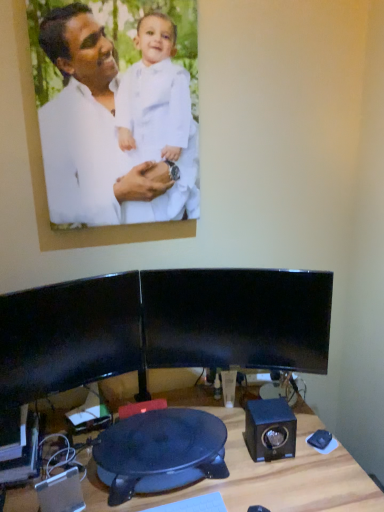
How much space does black plastic speaker at lower left, which is counted as the second speaker, starting from the right, occupy vertically?

black plastic speaker at lower left, which is counted as the second speaker, starting from the right, is 6.90 inches in height.

What is the approximate width of black plastic swivel chair at center?

black plastic swivel chair at center is 12.61 inches in width.

Where is `white matte picture frame at upper left`? This screenshot has height=512, width=384. white matte picture frame at upper left is located at coordinates (86, 151).

Where is `wooden desk at lower center`? This screenshot has height=512, width=384. wooden desk at lower center is located at coordinates (263, 476).

Is black plastic keyboard at lower center at the left side of black plastic swivel chair at center?

Incorrect, black plastic keyboard at lower center is not on the left side of black plastic swivel chair at center.

From a real-world perspective, is black plastic keyboard at lower center physically located above or below black plastic swivel chair at center?

Clearly, from a real-world perspective, black plastic keyboard at lower center is below black plastic swivel chair at center.

Considering the relative sizes of black plastic keyboard at lower center and black plastic swivel chair at center in the image provided, is black plastic keyboard at lower center wider than black plastic swivel chair at center?

No, black plastic keyboard at lower center is not wider than black plastic swivel chair at center.

Could you tell me if black plastic keyboard at lower center is turned towards black plastic swivel chair at center?

No.

Is blue matte speaker at lower right, which appears as the 2th speaker when viewed from the front, shorter than black plastic speaker at lower left, the 2th speaker when ordered from back to front?

Yes.

Looking at this image, is blue matte speaker at lower right, which appears as the 1th speaker when viewed from the right, not inside black plastic speaker at lower left, marked as the 1th speaker in a front-to-back arrangement?

Absolutely, blue matte speaker at lower right, which appears as the 1th speaker when viewed from the right, is external to black plastic speaker at lower left, marked as the 1th speaker in a front-to-back arrangement.

Would you say blue matte speaker at lower right, the first speaker viewed from the back, is a long distance from black plastic speaker at lower left, which is counted as the second speaker, starting from the right?

blue matte speaker at lower right, the first speaker viewed from the back, is actually quite close to black plastic speaker at lower left, which is counted as the second speaker, starting from the right.

From the image's perspective, which is above, blue matte speaker at lower right, which appears as the 1th speaker when viewed from the right, or white matte picture frame at upper left?

white matte picture frame at upper left appears higher in the image.

The width and height of the screenshot is (384, 512). Find the location of `speaker located on the right of white matte picture frame at upper left`. speaker located on the right of white matte picture frame at upper left is located at coordinates (270, 429).

Is the depth of blue matte speaker at lower right, the first speaker viewed from the back, greater than that of white matte picture frame at upper left?

Yes, blue matte speaker at lower right, the first speaker viewed from the back, is behind white matte picture frame at upper left.

Considering the positions of point (219, 495) and point (283, 428), is point (219, 495) closer or farther from the camera than point (283, 428)?

Clearly, point (219, 495) is closer to the camera than point (283, 428).

This screenshot has width=384, height=512. Identify the location of keyboard located underneath the blue matte speaker at lower right, the first speaker viewed from the back (from a real-world perspective). (194, 504).

Would you consider black plastic keyboard at lower center to be distant from blue matte speaker at lower right, which ranks as the second speaker in left-to-right order?

black plastic keyboard at lower center is near blue matte speaker at lower right, which ranks as the second speaker in left-to-right order, not far away.

Consider the image. Who is bigger, black glossy monitor at center, the 1th computer monitor positioned from the right, or black plastic keyboard at lower center?

black glossy monitor at center, the 1th computer monitor positioned from the right, is bigger.

Who is shorter, black glossy monitor at center, the 1th computer monitor positioned from the right, or black plastic keyboard at lower center?

Standing shorter between the two is black plastic keyboard at lower center.

Is black glossy monitor at center, acting as the 2th computer monitor starting from the right, shorter than black plastic speaker at lower left, which ranks as the 1th speaker in left-to-right order?

No, black glossy monitor at center, acting as the 2th computer monitor starting from the right, is not shorter than black plastic speaker at lower left, which ranks as the 1th speaker in left-to-right order.

Which object is positioned more to the left, black glossy monitor at center, the first computer monitor from the left, or black plastic speaker at lower left, the 2th speaker when ordered from back to front?

black glossy monitor at center, the first computer monitor from the left.

From the image's perspective, who appears lower, black glossy monitor at center, the first computer monitor from the left, or black plastic speaker at lower left, the 2th speaker when ordered from back to front?

black plastic speaker at lower left, the 2th speaker when ordered from back to front, appears lower in the image.

Based on the photo, could you tell me if black glossy monitor at center, the first computer monitor from the left, is turned towards black plastic speaker at lower left, which ranks as the 1th speaker in left-to-right order?

No, black glossy monitor at center, the first computer monitor from the left, is not turned towards black plastic speaker at lower left, which ranks as the 1th speaker in left-to-right order.

From a real-world perspective, is black glossy monitor at center, acting as the second computer monitor starting from the left, physically located above or below black plastic swivel chair at center?

black glossy monitor at center, acting as the second computer monitor starting from the left, is situated higher than black plastic swivel chair at center in the real world.

Between point (239, 276) and point (151, 482), which one is positioned behind?

The point (239, 276) is farther from the camera.

Is black plastic swivel chair at center a part of black glossy monitor at center, the 1th computer monitor positioned from the right?

No.

Can you tell me how much black glossy monitor at center, acting as the second computer monitor starting from the left, and black plastic swivel chair at center differ in facing direction?

There is a 18-degree angle between the facing directions of black glossy monitor at center, acting as the second computer monitor starting from the left, and black plastic swivel chair at center.

This screenshot has height=512, width=384. In order to click on swivel chair that is above the black plastic keyboard at lower center (from a real-world perspective) in this screenshot , I will do pyautogui.click(x=160, y=452).

Where is `speaker below the blue matte speaker at lower right, which appears as the 2th speaker when viewed from the front (from a real-world perspective)`? The height and width of the screenshot is (512, 384). speaker below the blue matte speaker at lower right, which appears as the 2th speaker when viewed from the front (from a real-world perspective) is located at coordinates (61, 492).

Based on their spatial positions, is black plastic speaker at lower left, which ranks as the 1th speaker in left-to-right order, or black glossy monitor at center, the 1th computer monitor positioned from the right, closer to blue matte speaker at lower right, which appears as the 2th speaker when viewed from the front?

black glossy monitor at center, the 1th computer monitor positioned from the right.

Considering their positions, is black glossy monitor at center, the 1th computer monitor positioned from the right, positioned closer to wooden desk at lower center than blue matte speaker at lower right, which ranks as the second speaker in left-to-right order?

The object closer to wooden desk at lower center is blue matte speaker at lower right, which ranks as the second speaker in left-to-right order.

From the image, which object appears to be nearer to black glossy monitor at center, the 1th computer monitor positioned from the right, black glossy monitor at center, acting as the 2th computer monitor starting from the right, or black plastic speaker at lower left, the 2th speaker when ordered from back to front?

black glossy monitor at center, acting as the 2th computer monitor starting from the right, is positioned closer to the anchor black glossy monitor at center, the 1th computer monitor positioned from the right.

Based on their spatial positions, is black plastic swivel chair at center or black plastic keyboard at lower center closer to wooden desk at lower center?

black plastic swivel chair at center lies closer to wooden desk at lower center than the other object.

Which object lies further to the anchor point black plastic speaker at lower left, marked as the 1th speaker in a front-to-back arrangement, wooden desk at lower center or black glossy monitor at center, the 1th computer monitor positioned from the right?

black glossy monitor at center, the 1th computer monitor positioned from the right, is further to black plastic speaker at lower left, marked as the 1th speaker in a front-to-back arrangement.

Considering their positions, is black plastic speaker at lower left, marked as the 1th speaker in a front-to-back arrangement, positioned closer to black glossy monitor at center, the 1th computer monitor positioned from the right, than black plastic keyboard at lower center?

black plastic keyboard at lower center is positioned closer to the anchor black glossy monitor at center, the 1th computer monitor positioned from the right.

From the image, which object appears to be farther from wooden desk at lower center, black plastic keyboard at lower center or white matte picture frame at upper left?

Among the two, white matte picture frame at upper left is located further to wooden desk at lower center.

Which object lies nearer to the anchor point white matte picture frame at upper left, blue matte speaker at lower right, the first speaker viewed from the back, or black glossy monitor at center, the first computer monitor from the left?

Among the two, black glossy monitor at center, the first computer monitor from the left, is located nearer to white matte picture frame at upper left.

The height and width of the screenshot is (512, 384). What are the coordinates of `swivel chair that lies between white matte picture frame at upper left and wooden desk at lower center from top to bottom` in the screenshot? It's located at (160, 452).

Find the location of a particular element. computer monitor located between black glossy monitor at center, acting as the 2th computer monitor starting from the right, and blue matte speaker at lower right, which appears as the 2th speaker when viewed from the front, in the left-right direction is located at coordinates (237, 319).

The height and width of the screenshot is (512, 384). In order to click on speaker between black plastic swivel chair at center and wooden desk at lower center vertically in this screenshot , I will do `click(61, 492)`.

Locate an element on the screen. This screenshot has height=512, width=384. keyboard that lies between black glossy monitor at center, the 1th computer monitor positioned from the right, and wooden desk at lower center from top to bottom is located at coordinates (194, 504).